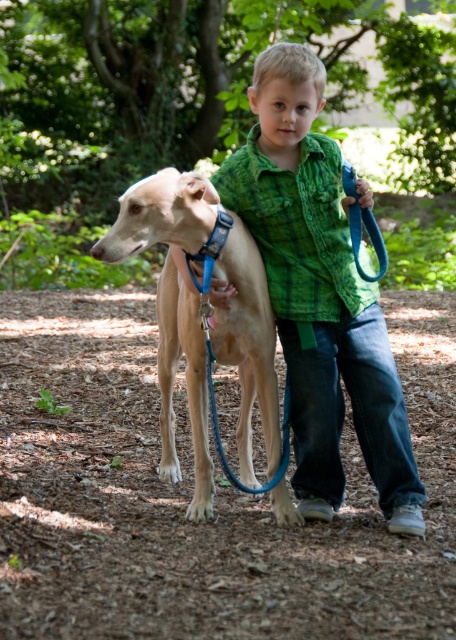
Locate an element on the screen. The height and width of the screenshot is (640, 456). green plaid shirt at center is located at coordinates (320, 292).

Which is behind, point (306, 372) or point (156, 208)?

The point (306, 372) is more distant.

The width and height of the screenshot is (456, 640). I want to click on green plaid shirt at center, so click(x=320, y=292).